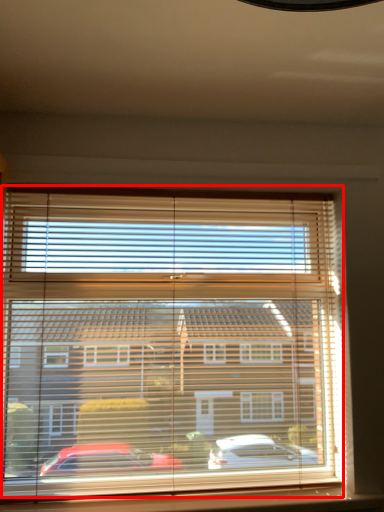
Question: From the image's perspective, where is bay window (annotated by the red box) located relative to window sill?

Choices:
 (A) below
 (B) above

Answer: (B)